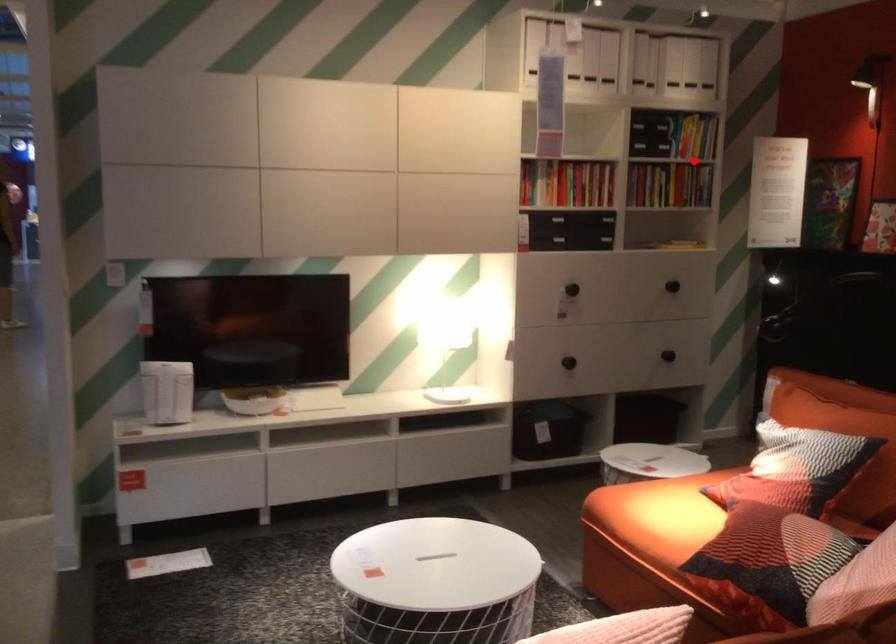
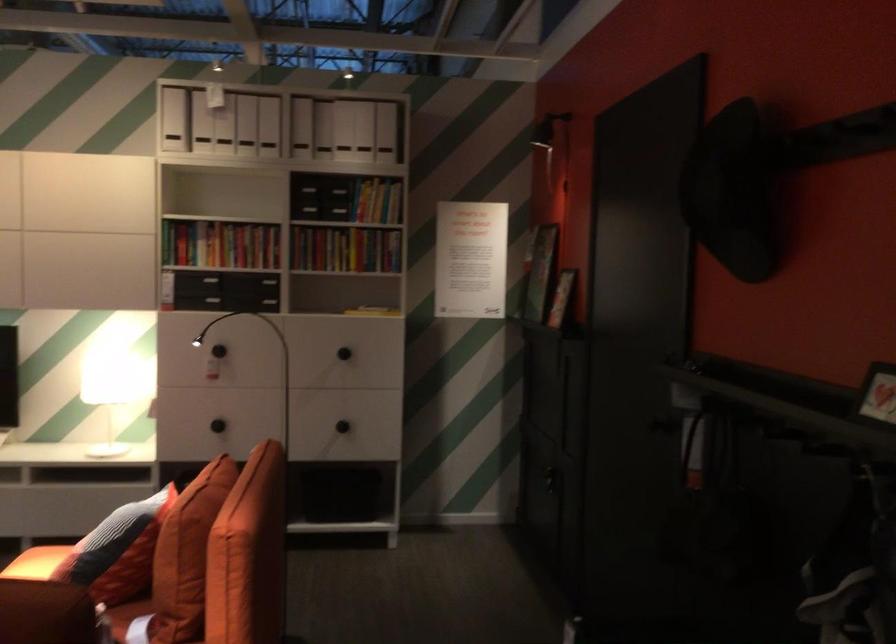
The point at the highlighted location is marked in the first image. Where is the corresponding point in the second image?

(345, 249)